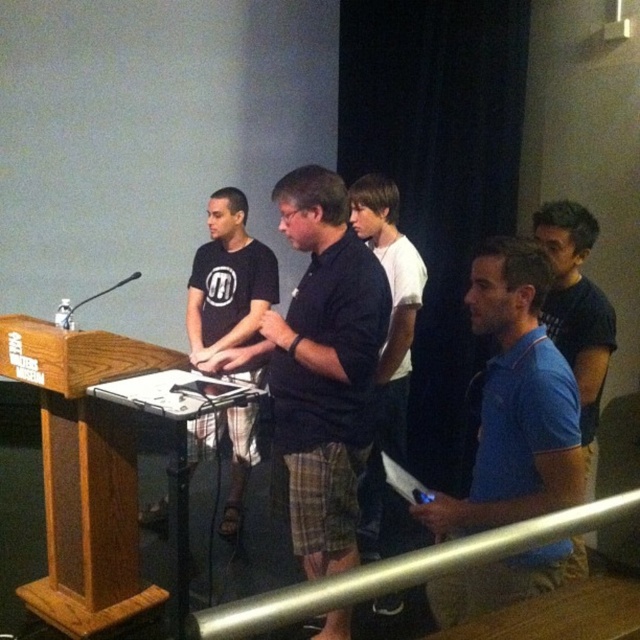
Question: Which point is farther from the camera taking this photo?

Choices:
 (A) (577, 472)
 (B) (630, 508)

Answer: (A)

Question: Which object appears closest to the camera in this image?

Choices:
 (A) blue cotton polo shirt at center
 (B) black cotton shirt at center
 (C) blue fabric shirt at right
 (D) matte black t-shirt at center

Answer: (A)

Question: Is matte black t-shirt at center behind metallic silver rail at lower center?

Choices:
 (A) no
 (B) yes

Answer: (B)

Question: Among these points, which one is farthest from the camera?

Choices:
 (A) (61, 321)
 (B) (352, 348)
 (C) (397, 320)
 (D) (220, 214)

Answer: (D)

Question: Is black cotton shirt at center closer to the viewer compared to matte black t-shirt at center?

Choices:
 (A) yes
 (B) no

Answer: (A)

Question: Is blue cotton polo shirt at center thinner than metallic silver rail at lower center?

Choices:
 (A) yes
 (B) no

Answer: (A)